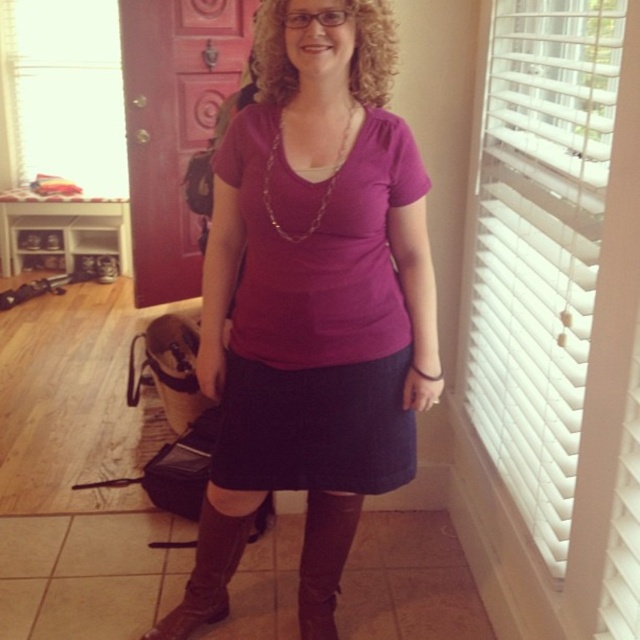
Can you confirm if dark blue fabric skirt at center is positioned above gold chain necklace at center?

No.

Measure the distance from dark blue fabric skirt at center to gold chain necklace at center.

dark blue fabric skirt at center is 18.96 inches from gold chain necklace at center.

Is point (340, 490) positioned after point (308, 228)?

Yes, point (340, 490) is behind point (308, 228).

Find the location of a particular element. This screenshot has height=640, width=640. dark blue fabric skirt at center is located at coordinates (316, 428).

Is leather at center thinner than gold chain necklace at center?

Yes, leather at center is thinner than gold chain necklace at center.

Is leather at center smaller than gold chain necklace at center?

Incorrect, leather at center is not smaller in size than gold chain necklace at center.

Does point (321, 616) come behind point (276, 129)?

Yes, it is behind point (276, 129).

Where is `leather at center`? leather at center is located at coordinates (324, 560).

Does matte purple shirt at center have a greater height compared to dark blue fabric skirt at center?

Indeed, matte purple shirt at center has a greater height compared to dark blue fabric skirt at center.

Which of these two, matte purple shirt at center or dark blue fabric skirt at center, stands taller?

matte purple shirt at center

Who is more forward, (246, 321) or (376, 358)?

Positioned in front is point (246, 321).

Where is `matte purple shirt at center`? The width and height of the screenshot is (640, 640). matte purple shirt at center is located at coordinates (312, 301).